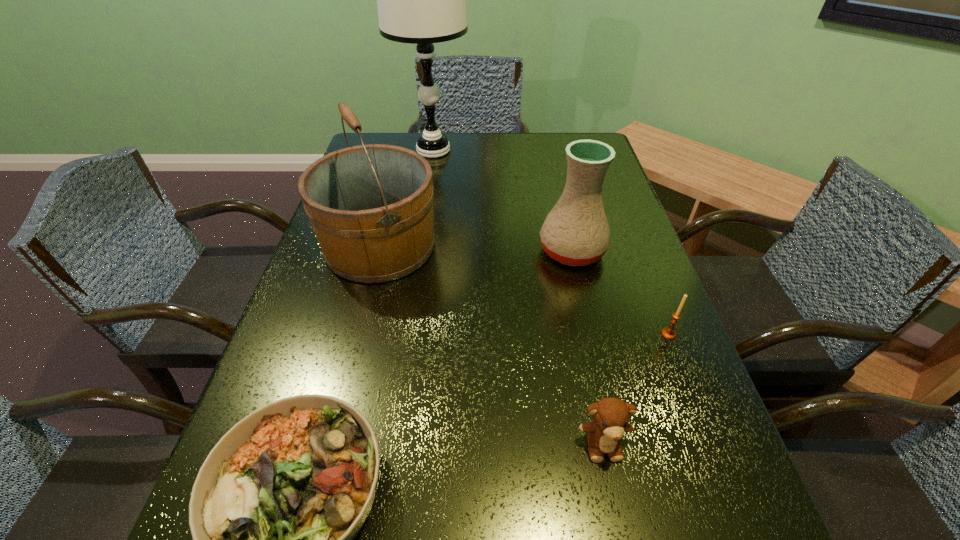
At what (x,y) coordinates should I click in order to perform the action: click on vacant region located on the left of the fourth farthest object. Please return your answer as a coordinate pair (x, y). The width and height of the screenshot is (960, 540). Looking at the image, I should click on (626, 334).

What are the coordinates of `vacant space located 0.100m on the face of the teddy bear` in the screenshot? It's located at (622, 535).

Where is `object present at the far edge`? object present at the far edge is located at coordinates (421, 0).

Locate an element on the screen. table lamp present at the left edge is located at coordinates (421, 0).

I want to click on bucket present at the left edge, so click(x=371, y=206).

Locate an element on the screen. The height and width of the screenshot is (540, 960). pottery situated at the right edge is located at coordinates (576, 232).

Locate an element on the screen. candle_holder located at the right edge is located at coordinates (668, 332).

This screenshot has height=540, width=960. Find the location of `teddy bear located in the right edge section of the desktop`. teddy bear located in the right edge section of the desktop is located at coordinates (611, 416).

Identify the location of object that is at the far left corner. (421, 0).

Find the location of a particular element. The image size is (960, 540). free space at the left edge of the desktop is located at coordinates (341, 313).